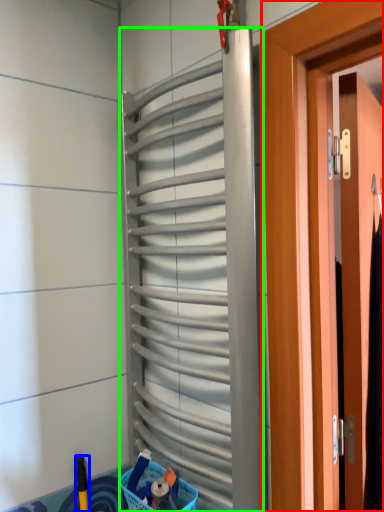
Question: Which is nearer to the door (highlighted by a red box)? brush (highlighted by a blue box) or shutter (highlighted by a green box).

Choices:
 (A) brush
 (B) shutter

Answer: (B)